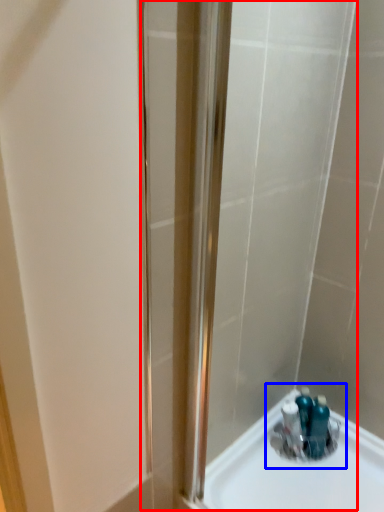
Question: Which point is closer to the camera, shower door (highlighted by a red box) or sink (highlighted by a blue box)?

Choices:
 (A) shower door
 (B) sink

Answer: (A)